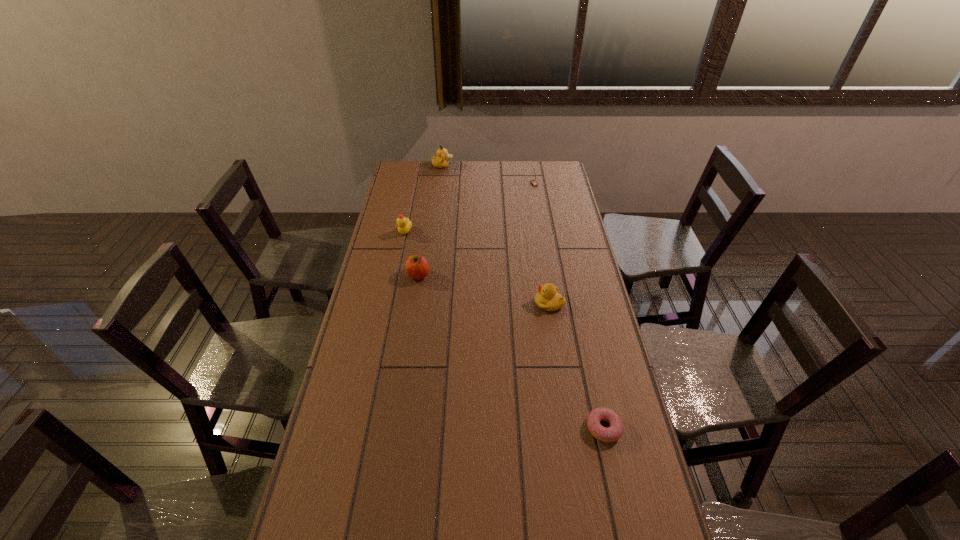
The image size is (960, 540). I want to click on free region located on the face of the farthest object, so click(x=497, y=166).

Where is `free space located 0.170m on the front-facing side of the leftmost object`? This screenshot has width=960, height=540. free space located 0.170m on the front-facing side of the leftmost object is located at coordinates (398, 265).

This screenshot has width=960, height=540. What are the coordinates of `vacant region located on the right of the third nearest object` in the screenshot? It's located at (492, 275).

This screenshot has width=960, height=540. I want to click on free space located 0.360m on the front of the matchbox, so click(542, 231).

You are a GUI agent. You are given a task and a screenshot of the screen. Output one action in this format:
    pyautogui.click(x=<x>, y=<y>)
    Task: Click on the vacant space situated 0.260m on the front-facing side of the second nearest object
    The height and width of the screenshot is (540, 960).
    Given the screenshot: What is the action you would take?
    pyautogui.click(x=463, y=303)

Identify the location of free region located 0.340m on the front-facing side of the second nearest object. The height and width of the screenshot is (540, 960). (441, 303).

Locate an element on the screen. vacant space positioned 0.060m on the front-facing side of the second nearest object is located at coordinates (517, 303).

Where is `vacant region located 0.070m on the back of the shortest object`? This screenshot has height=540, width=960. vacant region located 0.070m on the back of the shortest object is located at coordinates (595, 392).

Locate an element on the screen. duckling present at the far edge is located at coordinates (440, 161).

I want to click on matchbox that is at the far edge, so click(x=533, y=182).